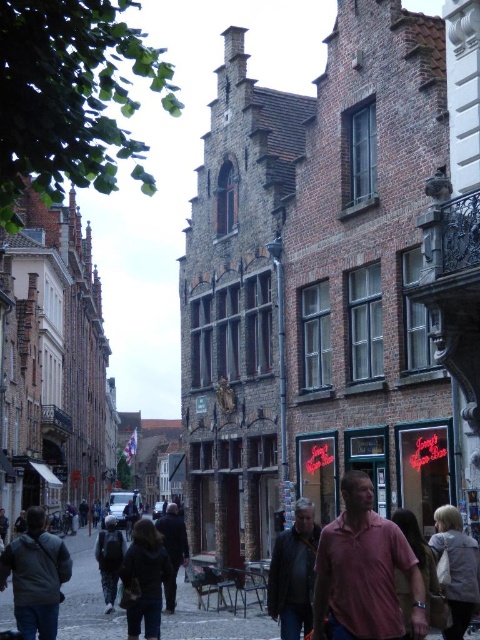
You are a photographer standing at the end of the street facing the row of buildings. You notice a person wearing a matte pink shirt at center and another wearing a dark gray jacket at lower left. Which clothing item is shorter in height?

The matte pink shirt at center is shorter than the dark gray jacket at lower left.